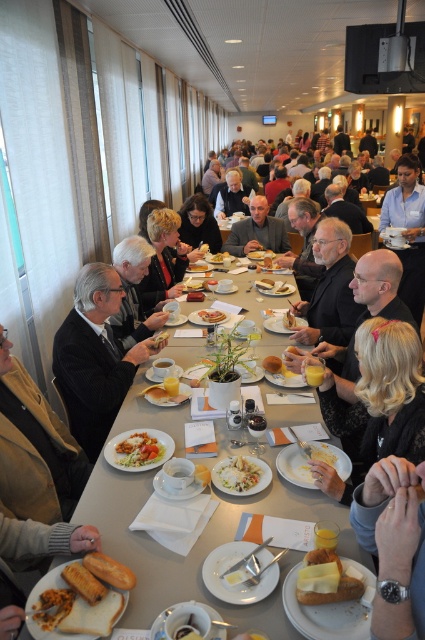
Question: Is dark suit at left above carrot salad at center?

Choices:
 (A) no
 (B) yes

Answer: (B)

Question: Which object is the farthest from the carrot salad at center?

Choices:
 (A) brown bread at lower left
 (B) white creamy pasta at center
 (C) dark suit at left
 (D) matte black jacket at center

Answer: (D)

Question: Which object is positioned farthest from the matte brown plate at center?

Choices:
 (A) carrot salad at center
 (B) matte black jacket at center
 (C) golden brown bread at center
 (D) blonde hair at center

Answer: (B)

Question: Which point is closer to the camera?

Choices:
 (A) smooth white bowl at center
 (B) golden brown bread at center

Answer: (A)

Question: From the image, what is the correct spatial relationship of carrot salad at center in relation to white glossy table at center?

Choices:
 (A) above
 (B) below

Answer: (B)

Question: Does smooth gray suit at center appear on the left side of white creamy pasta at center?

Choices:
 (A) yes
 (B) no

Answer: (B)